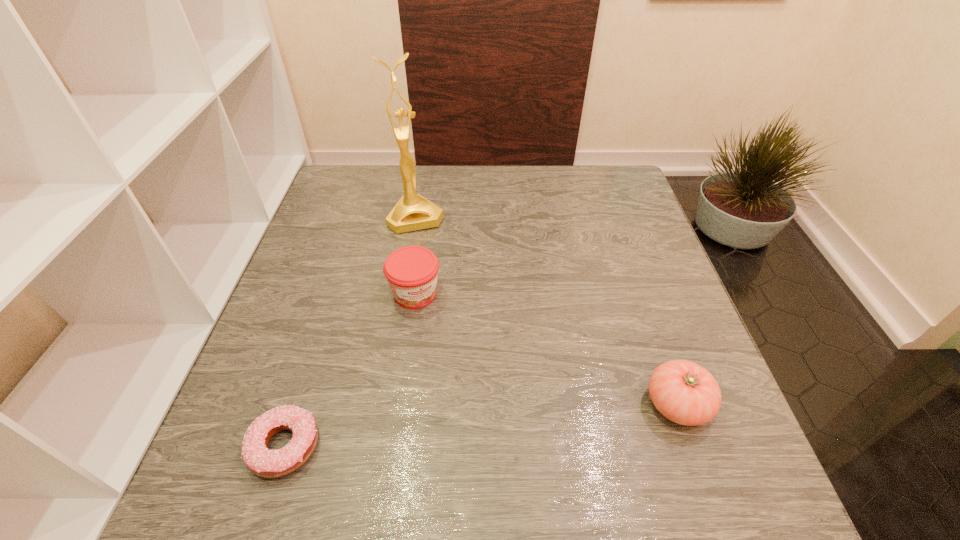
Identify the location of the leftmost object. (263, 462).

The height and width of the screenshot is (540, 960). I want to click on the shortest object, so click(263, 462).

This screenshot has height=540, width=960. Identify the location of tomato. (684, 392).

Locate an element on the screen. Image resolution: width=960 pixels, height=540 pixels. jam is located at coordinates (411, 271).

At what (x,y) coordinates should I click in order to perform the action: click on the farthest object. Please return your answer as a coordinate pair (x, y). This screenshot has height=540, width=960. Looking at the image, I should click on (413, 212).

Where is `award`? The height and width of the screenshot is (540, 960). award is located at coordinates (413, 212).

This screenshot has width=960, height=540. I want to click on blank space located 0.280m on the back of the doughnut, so pyautogui.click(x=331, y=300).

The height and width of the screenshot is (540, 960). I want to click on vacant space located 0.310m on the back of the tomato, so click(629, 266).

The width and height of the screenshot is (960, 540). In order to click on vacant region located 0.210m on the label side of the third nearest object in this screenshot , I will do `click(469, 384)`.

In order to click on vacant region located 0.060m on the label side of the third nearest object in this screenshot , I will do `click(437, 330)`.